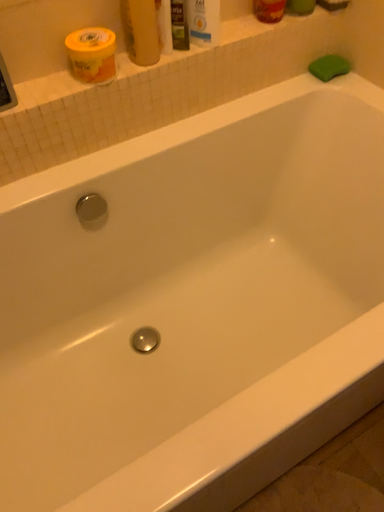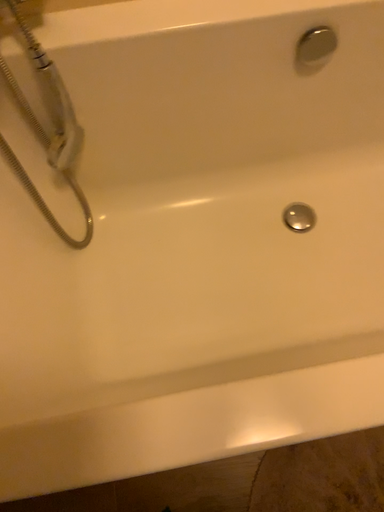
Question: Which way did the camera rotate in the video?

Choices:
 (A) rotated downward
 (B) rotated upward

Answer: (A)